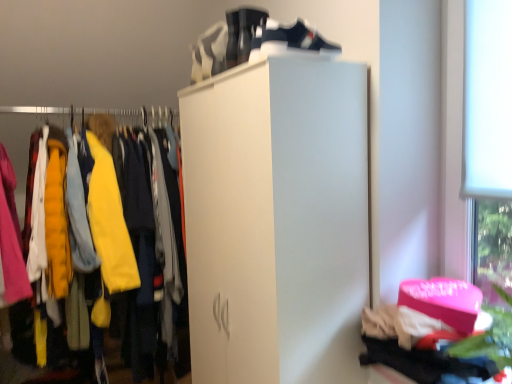
Question: From a real-world perspective, is white leather shoe at upper center positioned above or below white matte running shoe at upper center?

Choices:
 (A) below
 (B) above

Answer: (A)

Question: Considering the relative positions of white leather shoe at upper center and white matte running shoe at upper center in the image provided, is white leather shoe at upper center to the left or to the right of white matte running shoe at upper center?

Choices:
 (A) left
 (B) right

Answer: (B)

Question: Considering the real-world distances, which object is closest to the white matte closet at left?

Choices:
 (A) white leather shoe at upper center
 (B) white matte running shoe at upper center

Answer: (B)

Question: Which object is positioned closest to the white matte running shoe at upper center?

Choices:
 (A) white matte closet at left
 (B) white leather shoe at upper center

Answer: (B)